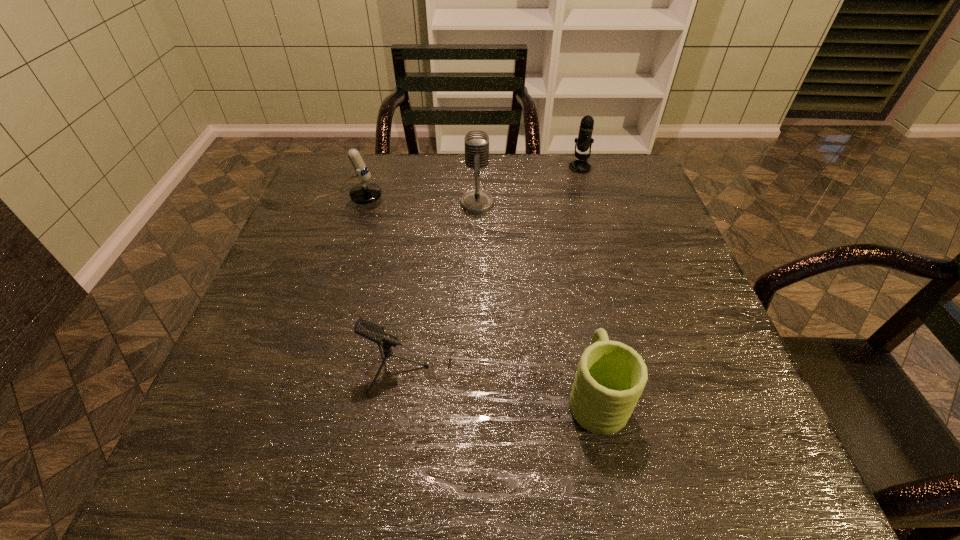
You are a GUI agent. You are given a task and a screenshot of the screen. Output one action in this format:
    pyautogui.click(x=<x>, y=<y>)
    Task: Click on the free area in between the leftmost microphone and the tallest object
    
    Given the screenshot: What is the action you would take?
    pyautogui.click(x=411, y=202)

The height and width of the screenshot is (540, 960). I want to click on free space that is in between the tallest object and the leftmost object, so click(x=411, y=202).

Where is `vacant area that lies between the mug and the rightmost microphone`? vacant area that lies between the mug and the rightmost microphone is located at coordinates (588, 281).

I want to click on free space between the tallest object and the leftmost microphone, so click(x=411, y=202).

Where is `unoccupied area between the tallest microphone and the farthest microphone`? unoccupied area between the tallest microphone and the farthest microphone is located at coordinates (528, 185).

The height and width of the screenshot is (540, 960). What are the coordinates of `object that is the second closest to the leftmost microphone` in the screenshot? It's located at (369, 330).

Where is `object identified as the second closest to the mug`? object identified as the second closest to the mug is located at coordinates (476, 142).

At what (x,y) coordinates should I click in order to perform the action: click on microphone that stands as the closest to the rightmost object. Please return your answer as a coordinate pair (x, y). The width and height of the screenshot is (960, 540). Looking at the image, I should click on (476, 142).

At what (x,y) coordinates should I click in order to perform the action: click on the second closest microphone to the tallest microphone. Please return your answer as a coordinate pair (x, y). Looking at the image, I should click on (584, 141).

The height and width of the screenshot is (540, 960). In order to click on blank space that satisfies the following two spatial constraints: 1. on the side of the mug with the handle; 2. on the stand of the nearest microphone in this screenshot , I will do `click(590, 369)`.